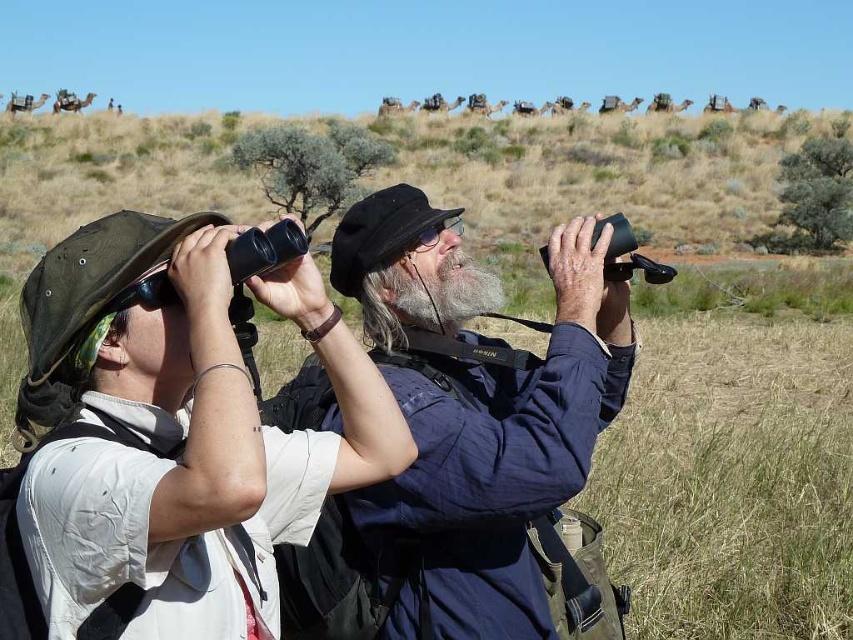
Question: Which object is farther from the camera taking this photo?

Choices:
 (A) matte black binoculars at left
 (B) blue fabric jacket at center
 (C) graywoollybeard at center

Answer: (C)

Question: Which of these objects is positioned closest to the matte black binoculars at left?

Choices:
 (A) blue fabric jacket at center
 (B) graywoollybeard at center

Answer: (A)

Question: Observing the image, what is the correct spatial positioning of matte black binoculars at left in reference to graywoollybeard at center?

Choices:
 (A) below
 (B) above

Answer: (A)

Question: Which object is positioned farthest from the graywoollybeard at center?

Choices:
 (A) matte black binoculars at left
 (B) blue fabric jacket at center

Answer: (A)

Question: Can you confirm if matte black binoculars at left is thinner than graywoollybeard at center?

Choices:
 (A) no
 (B) yes

Answer: (A)

Question: Does matte black binoculars at left have a greater width compared to blue fabric jacket at center?

Choices:
 (A) yes
 (B) no

Answer: (B)